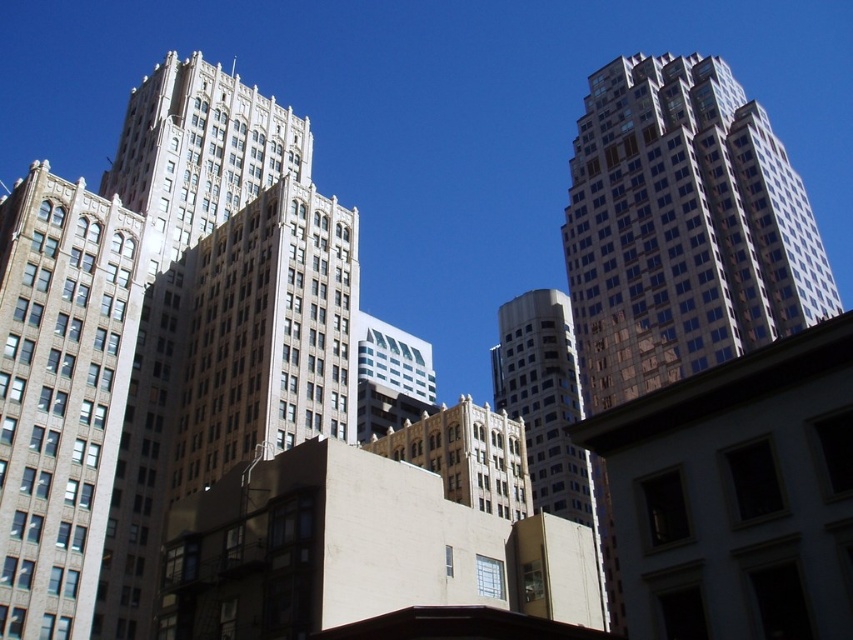
You are a city planner assessing the potential for a new pedestrian walkway between the reflective glass skyscraper at right and the brown brick building at left. Based on their widths, can you determine if there is enough space for a walkway that requires at least 3 meters of width between the buildings?

The reflective glass skyscraper at right might be wider than brown brick building at left, but without exact measurements, it is uncertain if there is sufficient space for a 3 meter walkway between them.

You are standing in the middle of the street between the reflective glass skyscraper at right and the brown brick building at left. Which building is positioned to your east?

The reflective glass skyscraper at right is to the east of the brown brick building at left, so if you are standing between them facing north, the reflective glass skyscraper at right would be to your east.